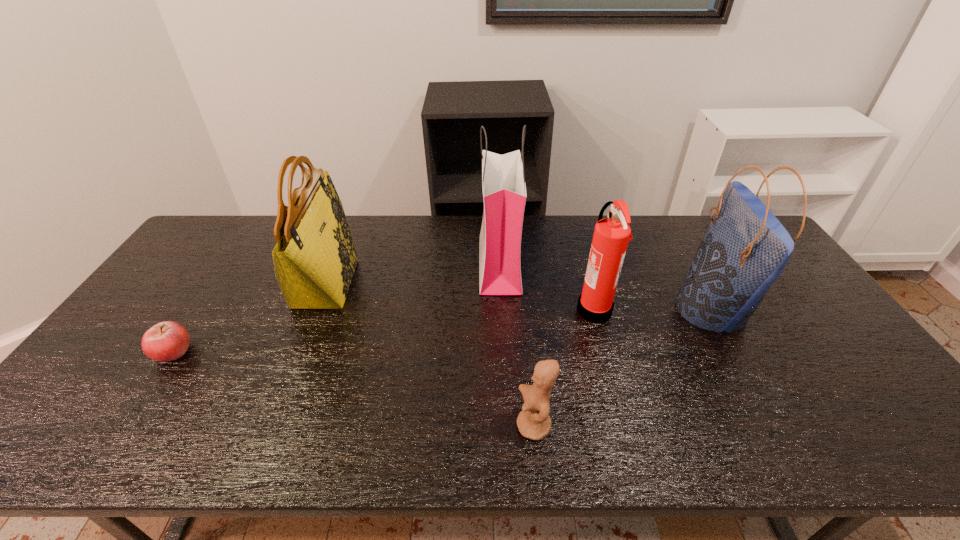
In order to click on shopping bag present at the far edge in this screenshot , I will do `click(504, 191)`.

Locate an element on the screen. This screenshot has height=540, width=960. tote bag that is at the far edge is located at coordinates (314, 259).

Find the location of a particular element. object at the near edge is located at coordinates (533, 422).

Where is `object that is positioned at the left edge`? Image resolution: width=960 pixels, height=540 pixels. object that is positioned at the left edge is located at coordinates (166, 341).

Locate an element on the screen. This screenshot has width=960, height=540. free space at the far edge is located at coordinates (678, 222).

You are a GUI agent. You are given a task and a screenshot of the screen. Output one action in this format:
    pyautogui.click(x=<x>, y=<y>)
    Task: Click on the vacant area at the near edge of the desktop
    The image size is (960, 540).
    Given the screenshot: What is the action you would take?
    pyautogui.click(x=311, y=449)

I want to click on vacant region at the left edge, so click(194, 276).

Find the location of a particular element. This screenshot has width=960, height=540. free region at the right edge of the desktop is located at coordinates (855, 364).

The image size is (960, 540). Find the location of `vacant space that is in between the second object from left to right and the fifth object from left to right`. vacant space that is in between the second object from left to right and the fifth object from left to right is located at coordinates (460, 296).

Where is `free space between the second object from right to left and the second object from left to right`? The width and height of the screenshot is (960, 540). free space between the second object from right to left and the second object from left to right is located at coordinates (460, 296).